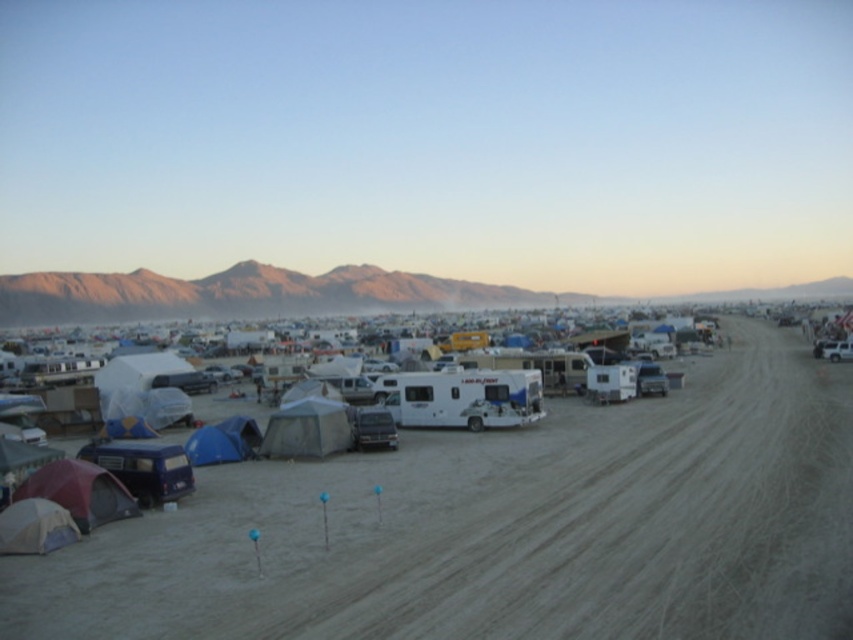
Based on the photo, you are a hiker planning to set up your tent in this desert area. You see a white matte tent at lower left and a blue fabric tent at lower left. Which tent should you choose if you want a larger shelter?

The blue fabric tent at lower left is larger than the white matte tent at lower left, so you should choose the blue fabric tent at lower left for a larger shelter.

You are a hiker who needs to set up a campsite. You see the maroon fabric tent at lower left and the blue matte van at lower left. Which object is closer to the dirt road?

The maroon fabric tent at lower left is 3.12 meters from the blue matte van at lower left. Since both are at the lower left, their distance from the road isn

You are standing at the camera position and want to walk towards the two points in the desert scene. Which point, point (77, 452) or point (344, 419), will you reach first?

You will reach point (77, 452) first because it is closer to the camera than point (344, 419).